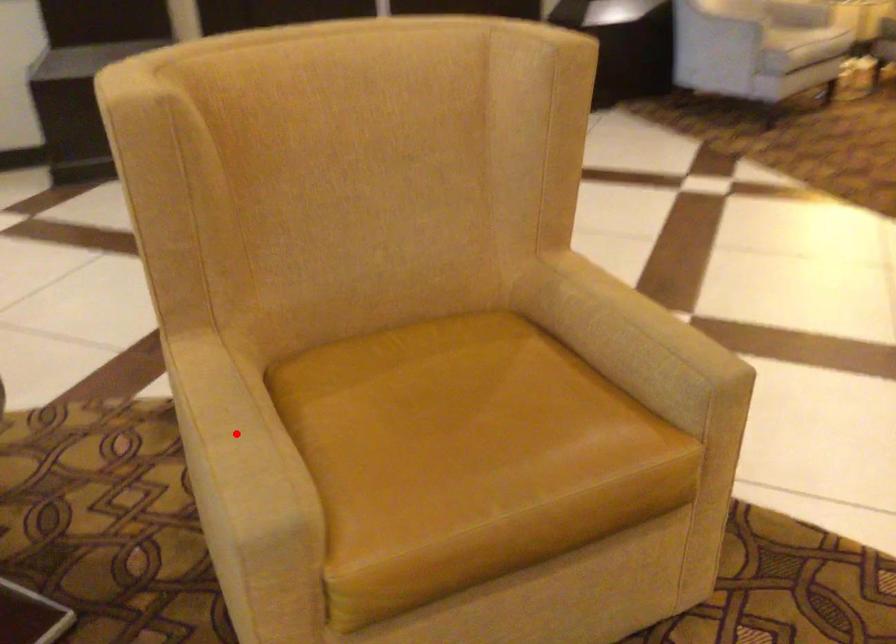
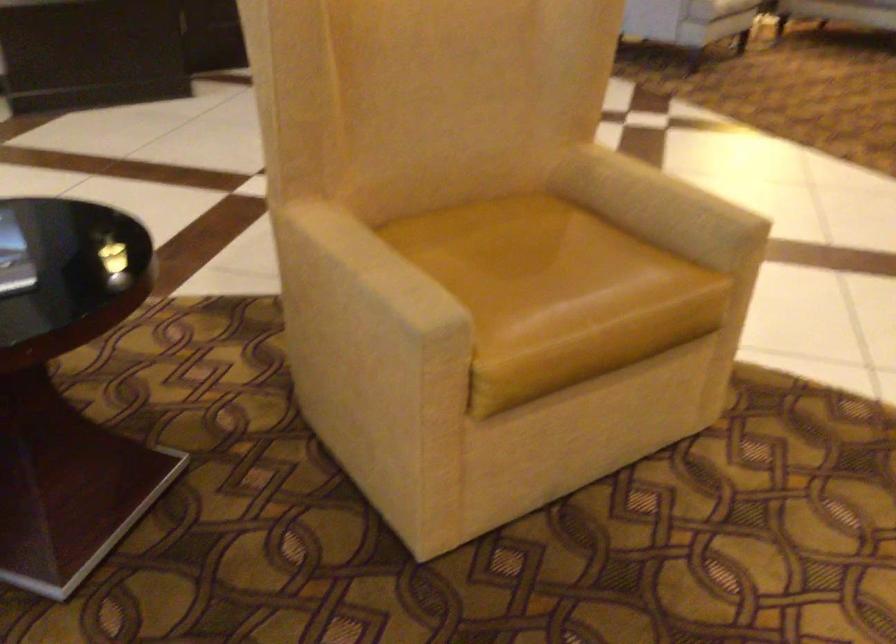
In the second image, find the point that corresponds to the highlighted location in the first image.

(375, 266)